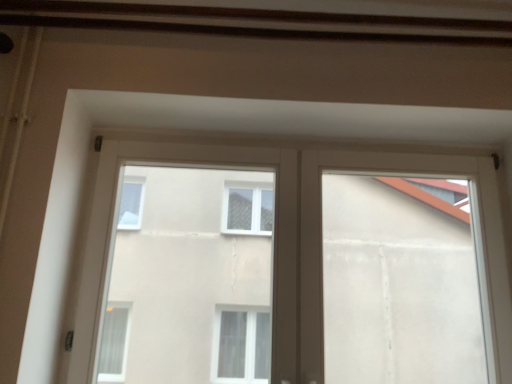
Question: From a real-world perspective, is transparent glass window at center located higher than white plastic window frame at upper center?

Choices:
 (A) no
 (B) yes

Answer: (B)

Question: Is transparent glass window at center turned away from white plastic window frame at upper center?

Choices:
 (A) yes
 (B) no

Answer: (A)

Question: Is transparent glass window at center surrounding white plastic window frame at upper center?

Choices:
 (A) yes
 (B) no

Answer: (B)

Question: Is transparent glass window at center completely or partially outside of white plastic window frame at upper center?

Choices:
 (A) no
 (B) yes

Answer: (A)

Question: Considering the relative sizes of transparent glass window at center and white plastic window frame at upper center in the image provided, is transparent glass window at center bigger than white plastic window frame at upper center?

Choices:
 (A) no
 (B) yes

Answer: (A)

Question: Considering the positions of point (389, 279) and point (386, 160), is point (389, 279) closer or farther from the camera than point (386, 160)?

Choices:
 (A) farther
 (B) closer

Answer: (A)

Question: Do you think white plastic window frame at upper center is within transparent glass window at center, or outside of it?

Choices:
 (A) outside
 (B) inside

Answer: (A)

Question: Considering the positions of white plastic window frame at upper center and transparent glass window at center in the image, is white plastic window frame at upper center taller or shorter than transparent glass window at center?

Choices:
 (A) tall
 (B) short

Answer: (B)

Question: From the image's perspective, relative to transparent glass window at center, is white plastic window frame at upper center above or below?

Choices:
 (A) above
 (B) below

Answer: (B)

Question: Is point (243, 203) closer or farther from the camera than point (433, 165)?

Choices:
 (A) farther
 (B) closer

Answer: (A)

Question: From a real-world perspective, is white plastic window at upper center above or below transparent glass window at center?

Choices:
 (A) below
 (B) above

Answer: (A)

Question: Is white plastic window at upper center bigger or smaller than transparent glass window at center?

Choices:
 (A) small
 (B) big

Answer: (B)

Question: From the image's perspective, is white plastic window at upper center above or below transparent glass window at center?

Choices:
 (A) below
 (B) above

Answer: (A)

Question: From a real-world perspective, is transparent glass window at center physically located above or below white plastic window at upper center?

Choices:
 (A) above
 (B) below

Answer: (A)

Question: Is transparent glass window at center to the left or to the right of white plastic window at upper center in the image?

Choices:
 (A) left
 (B) right

Answer: (B)